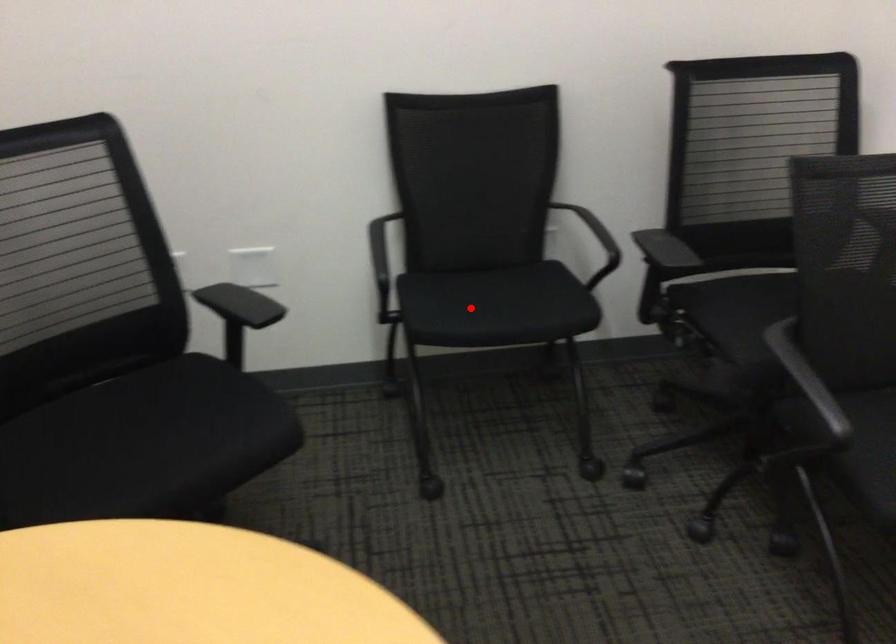
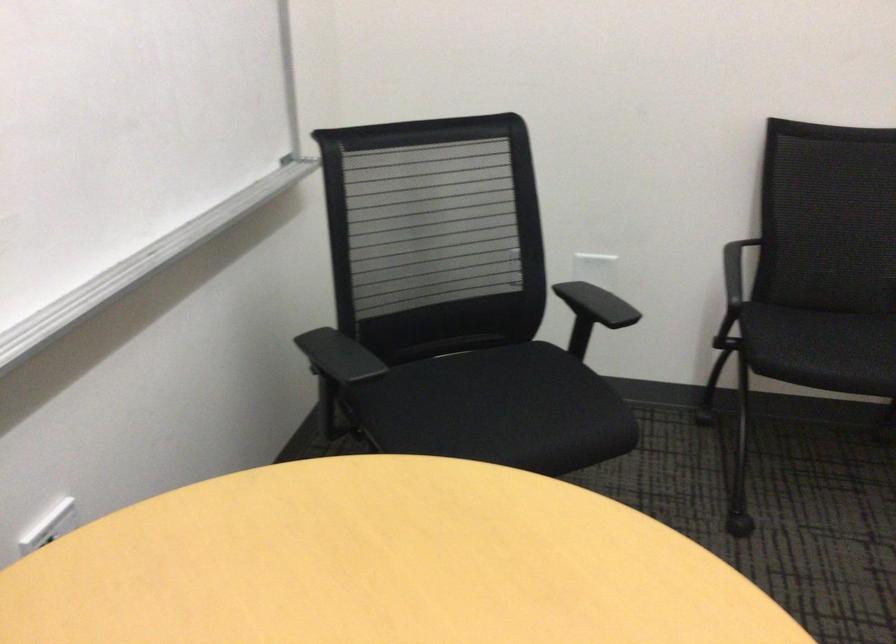
Question: I am providing you with two images of the same scene from different viewpoints. A red point is marked on the first image. Can you still see the location of the red point in image 2?

Choices:
 (A) Yes
 (B) No

Answer: (A)